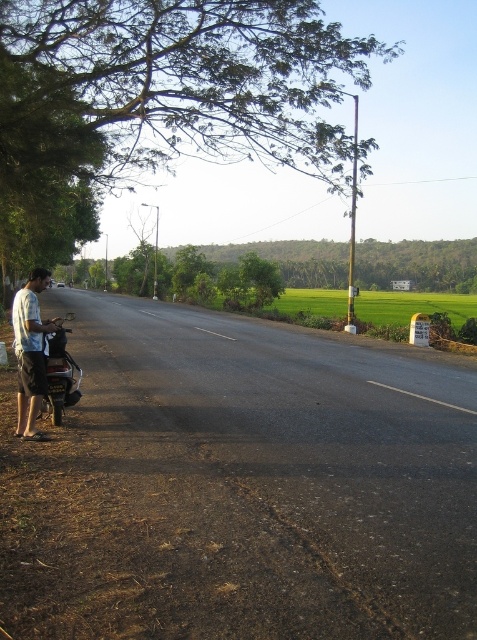
Who is taller, light blue cotton shirt at left or metallic silver scooter at left?

With more height is light blue cotton shirt at left.

Is point (32, 429) less distant than point (79, 385)?

That is True.

Where is `light blue cotton shirt at left`? This screenshot has height=640, width=477. light blue cotton shirt at left is located at coordinates (30, 353).